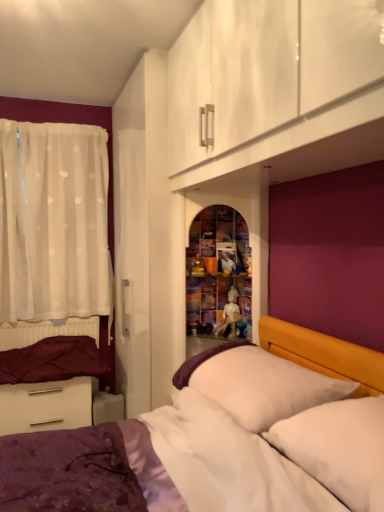
Where is `free point above matte white bed frame at lower left (from a real-world perspective)`? The image size is (384, 512). free point above matte white bed frame at lower left (from a real-world perspective) is located at coordinates pos(55,318).